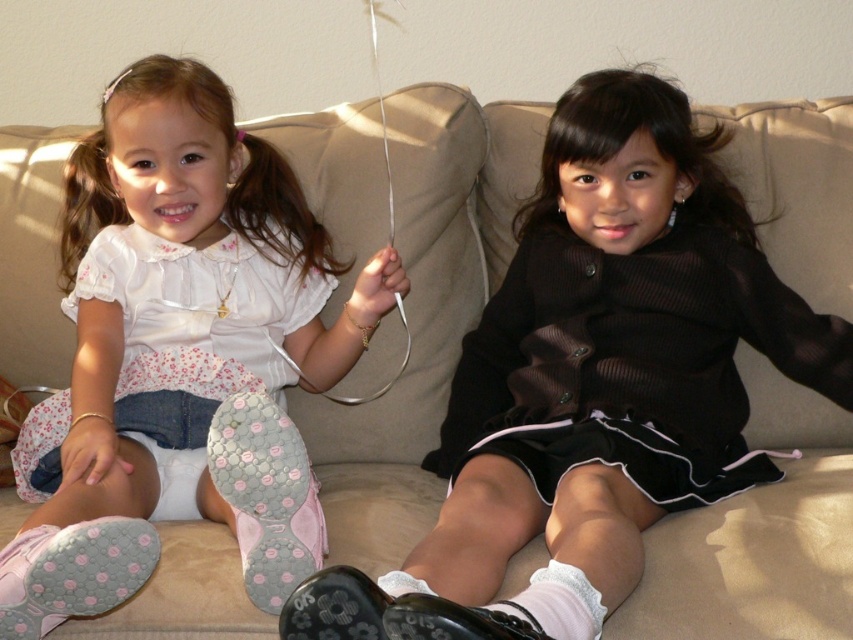
You are a photographer setting up a shoot in the living room. You notice the matte black dress at center and the matte pink sneakers at lower left. Which object is closer to the floor?

The matte pink sneakers at lower left are closer to the floor because the matte black dress at center is positioned under them.

You are a fashion designer observing the two girls on the couch. You need to determine which item is shorter in height between the matte black dress at center and the matte pink sneakers at lower left. Which one is shorter?

The matte black dress at center is shorter in height than the matte pink sneakers at lower left because the description states it is not as tall as the sneakers.

You are a photographer taking a picture of the two girls on the couch. You notice two points marked in the image. The first point is at coordinates point (416, 572) and the second is at point (322, 337). Which point is closer to the camera based on their positions?

Point (416, 572) is in front of point (322, 337), so it is closer to the camera.